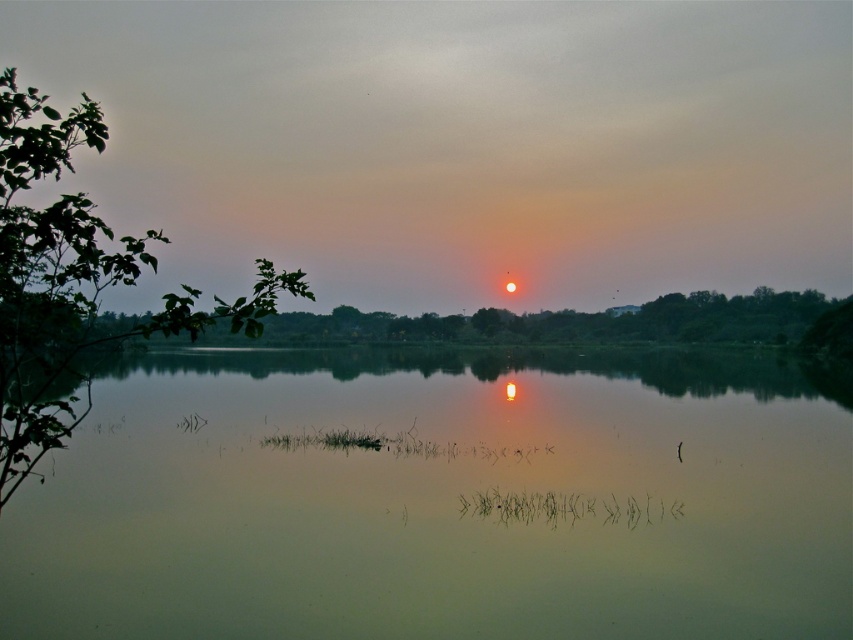
Between smooth reflective water at center and green leafy branch at left, which one appears on the right side from the viewer's perspective?

smooth reflective water at center

From the picture: Does smooth reflective water at center appear on the right side of green leafy branch at left?

Indeed, smooth reflective water at center is positioned on the right side of green leafy branch at left.

Between point (320, 387) and point (4, 244), which one is positioned behind?

The point (320, 387) is more distant.

Identify the location of smooth reflective water at center. This screenshot has width=853, height=640. (440, 502).